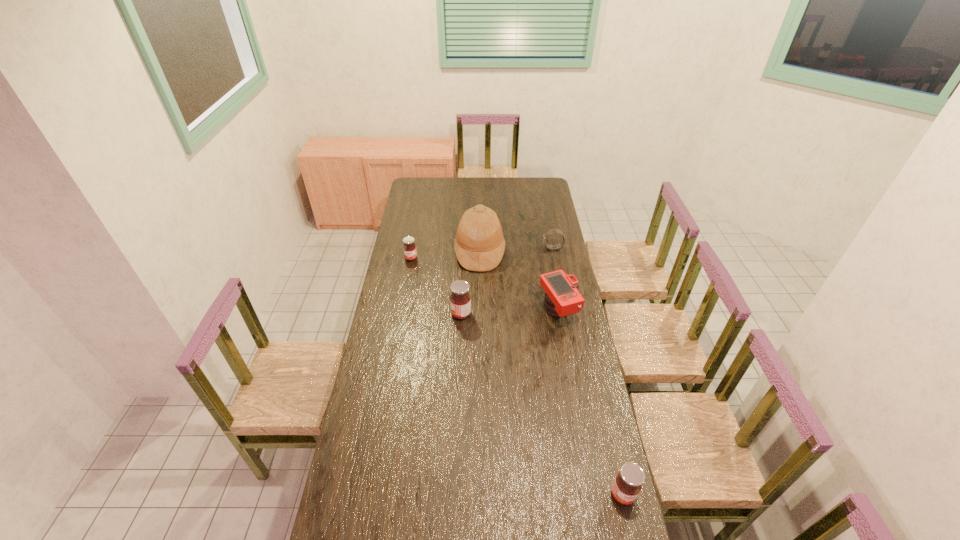
Find the location of a particular element. The image size is (960, 540). object that ranks as the closest to the farthest jam is located at coordinates (479, 244).

Locate which jam is the third closest to the camera. Please provide its 2D coordinates. Your answer should be formatted as a tuple, i.e. [(x, y)], where the tuple contains the x and y coordinates of a point satisfying the conditions above.

[(627, 484)]

Locate an element on the screen. The image size is (960, 540). jam that stands as the closest to the camera is located at coordinates [x=460, y=299].

At what (x,y) coordinates should I click in order to perform the action: click on vacant point that satisfies the following two spatial constraints: 1. on the back side of the camera; 2. on the front-facing side of the tallest object. Please return your answer as a coordinate pair (x, y). Image resolution: width=960 pixels, height=540 pixels. Looking at the image, I should click on point(547,252).

At what (x,y) coordinates should I click in order to perform the action: click on free space that satisfies the following two spatial constraints: 1. on the front-facing side of the hat; 2. on the right side of the camera. Please return your answer as a coordinate pair (x, y). Image resolution: width=960 pixels, height=540 pixels. Looking at the image, I should click on (480, 312).

Locate an element on the screen. free space that satisfies the following two spatial constraints: 1. on the front-facing side of the tallest object; 2. on the label side of the leftmost object is located at coordinates (480, 258).

Locate an element on the screen. blank space that satisfies the following two spatial constraints: 1. on the label side of the camera; 2. on the left side of the shortest jam is located at coordinates (401, 312).

Identify the location of blank space that satisfies the following two spatial constraints: 1. on the face of the watch; 2. on the label side of the shortest jam. (555, 258).